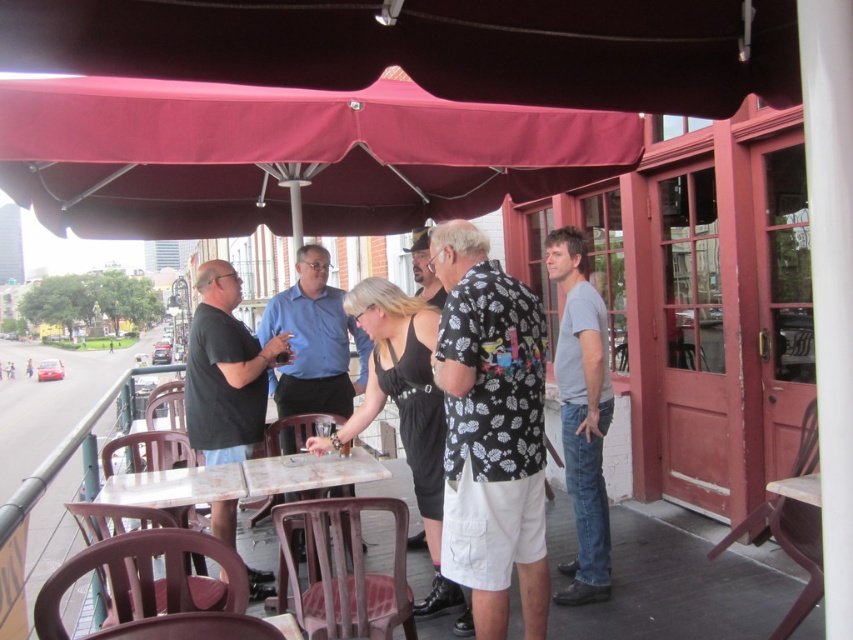
Is black matte shirt at center above white marble table at center?

Indeed, black matte shirt at center is positioned over white marble table at center.

Does point (241, 340) come behind point (310, 465)?

Yes.

Identify the location of black matte shirt at center. (225, 371).

Does point (483, 528) lie in front of point (207, 490)?

Yes, it is.

Can you confirm if black floral shirt at center is positioned above white marble table at center?

Yes, black floral shirt at center is above white marble table at center.

The height and width of the screenshot is (640, 853). Find the location of `black floral shirt at center`. black floral shirt at center is located at coordinates (491, 429).

At what (x,y) coordinates should I click in order to perform the action: click on black floral shirt at center. Please return your answer as a coordinate pair (x, y). The height and width of the screenshot is (640, 853). Looking at the image, I should click on (491, 429).

Can you confirm if black floral shirt at center is bigger than black matte dress at center?

No, black floral shirt at center is not bigger than black matte dress at center.

Between black floral shirt at center and black matte dress at center, which one has less height?

black matte dress at center

Is point (531, 314) positioned behind point (410, 408)?

No, (531, 314) is in front of (410, 408).

Locate an element on the screen. black floral shirt at center is located at coordinates (491, 429).